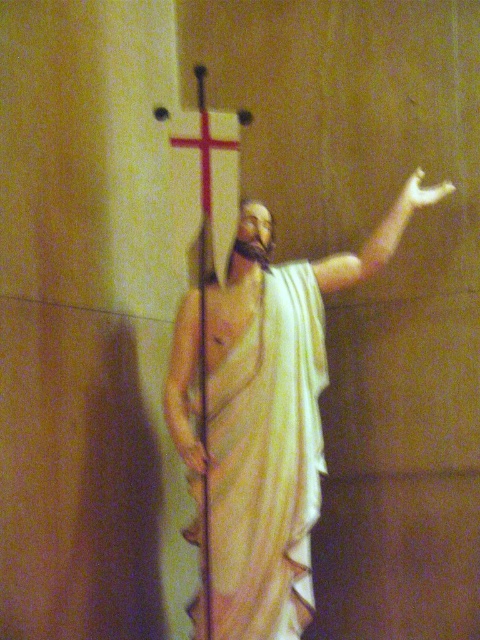
Is matte white statue at center further to camera compared to white draped cloth at center?

That is True.

Can you confirm if matte white statue at center is shorter than white draped cloth at center?

No.

Who is more forward, (235,332) or (262,579)?

Point (262,579) is in front.

The width and height of the screenshot is (480, 640). I want to click on matte white statue at center, so click(266, 413).

Is matte white statue at center taller than red wood cross at center?

Yes, matte white statue at center is taller than red wood cross at center.

Does matte white statue at center appear over red wood cross at center?

No.

Which is behind, point (266, 214) or point (235, 140)?

The point (266, 214) is behind.

Locate an element on the screen. This screenshot has width=480, height=640. matte white statue at center is located at coordinates (266, 413).

Between white draped cloth at center and red wood cross at center, which one has more height?

white draped cloth at center is taller.

Which of these two, white draped cloth at center or red wood cross at center, stands shorter?

red wood cross at center is shorter.

The width and height of the screenshot is (480, 640). What do you see at coordinates (267, 460) in the screenshot?
I see `white draped cloth at center` at bounding box center [267, 460].

Image resolution: width=480 pixels, height=640 pixels. Identify the location of white draped cloth at center. (267, 460).